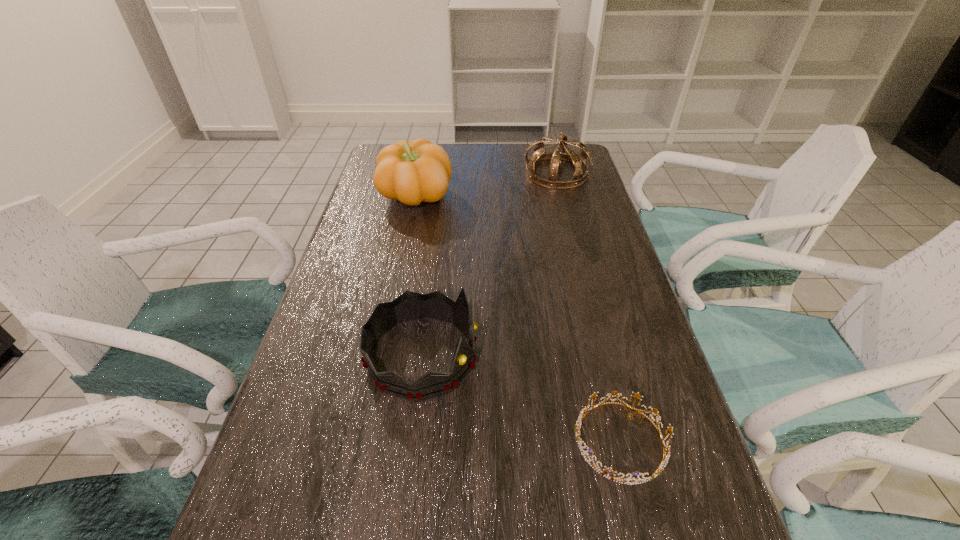
Find the location of a particular element. This screenshot has width=960, height=540. pumpkin is located at coordinates (412, 172).

You are a GUI agent. You are given a task and a screenshot of the screen. Output one action in this format:
    pyautogui.click(x=<x>, y=<y>)
    Task: Click on the leftmost tiara
    
    Given the screenshot: What is the action you would take?
    pyautogui.click(x=409, y=306)

Identify the location of the farthest tiara. (579, 161).

Image resolution: width=960 pixels, height=540 pixels. Find the location of `the shortest tiara`. the shortest tiara is located at coordinates (659, 470).

Locate an element on the screen. This screenshot has width=960, height=540. vacant space located 0.100m on the back of the pumpkin is located at coordinates (422, 164).

Locate an element on the screen. vacant space located at the front of the leftmost tiara with jewels is located at coordinates (644, 355).

The height and width of the screenshot is (540, 960). I want to click on vacant space located 0.340m on the front of the farthest tiara, so click(578, 256).

I want to click on vacant space located 0.360m on the front-facing side of the shortest tiara, so click(x=372, y=441).

Find the location of a particular element. The width and height of the screenshot is (960, 540). free region located 0.090m on the front-facing side of the shortest tiara is located at coordinates (523, 441).

The height and width of the screenshot is (540, 960). What are the coordinates of `vacant space located on the front-facing side of the shortest tiara` in the screenshot? It's located at (512, 441).